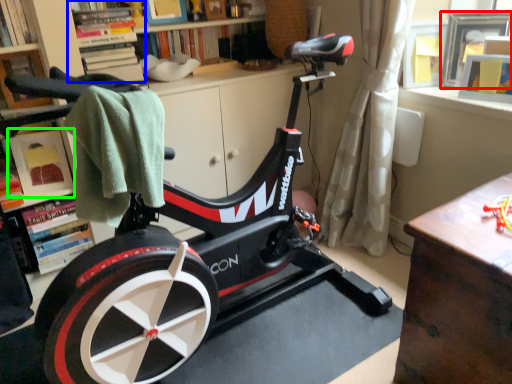
Question: Which object is the farthest from picture frame (highlighted by a red box)? Choose among these: shelf (highlighted by a blue box) or shelf (highlighted by a green box).

Choices:
 (A) shelf
 (B) shelf

Answer: (B)